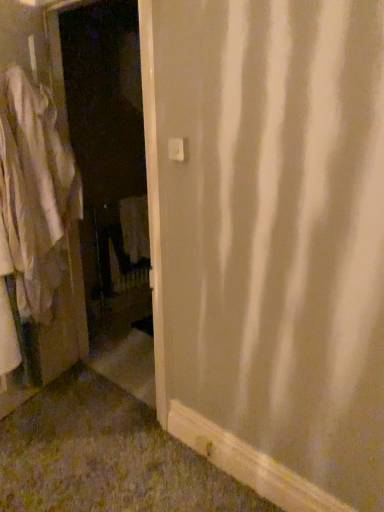
Question: Does point (44, 256) appear closer or farther from the camera than point (82, 106)?

Choices:
 (A) farther
 (B) closer

Answer: (B)

Question: From a real-world perspective, is white cotton shirt at left above or below white matte screen door at left?

Choices:
 (A) above
 (B) below

Answer: (A)

Question: Considering the relative positions of white cotton shirt at left and white matte screen door at left in the image provided, is white cotton shirt at left to the left or to the right of white matte screen door at left?

Choices:
 (A) right
 (B) left

Answer: (B)

Question: In terms of size, does white matte screen door at left appear bigger or smaller than white cotton shirt at left?

Choices:
 (A) big
 (B) small

Answer: (A)

Question: Is point [99, 106] positioned closer to the camera than point [69, 176]?

Choices:
 (A) farther
 (B) closer

Answer: (A)

Question: Considering their positions, is white matte screen door at left located in front of or behind white cotton shirt at left?

Choices:
 (A) front
 (B) behind

Answer: (A)

Question: From the image's perspective, is white matte screen door at left above or below white cotton shirt at left?

Choices:
 (A) below
 (B) above

Answer: (B)